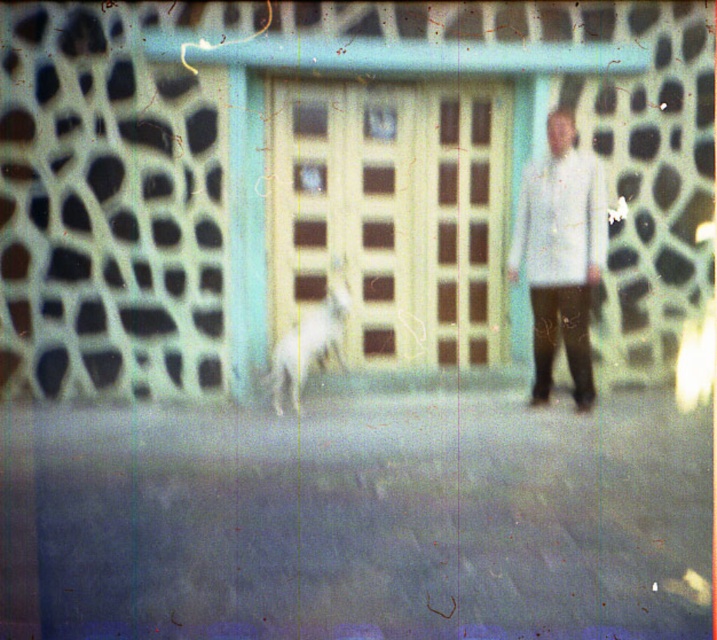
Question: Estimate the real-world distances between objects in this image. Which object is closer to the yellow matte door at center?

Choices:
 (A) white fur dog at center
 (B) white matte shirt at center

Answer: (A)

Question: Is white matte shirt at center positioned at the back of white fur dog at center?

Choices:
 (A) yes
 (B) no

Answer: (B)

Question: Among these points, which one is nearest to the camera?

Choices:
 (A) (560, 269)
 (B) (313, 310)
 (C) (348, 285)

Answer: (A)

Question: Does white matte shirt at center come behind white fur dog at center?

Choices:
 (A) yes
 (B) no

Answer: (B)

Question: Is white matte shirt at center smaller than white fur dog at center?

Choices:
 (A) no
 (B) yes

Answer: (A)

Question: Which point appears farthest from the camera in this image?

Choices:
 (A) (541, 284)
 (B) (369, 205)
 (C) (333, 259)

Answer: (C)